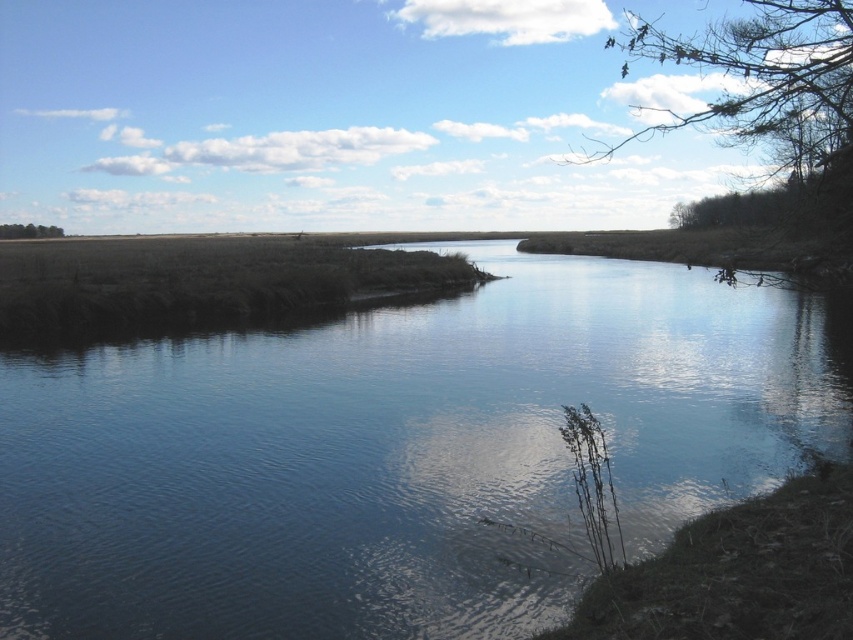
Question: Is clear water at center to the left of green leafy tree at left from the viewer's perspective?

Choices:
 (A) no
 (B) yes

Answer: (A)

Question: Among these points, which one is farthest from the camera?

Choices:
 (A) (16, 228)
 (B) (795, 244)
 (C) (448, 410)

Answer: (A)

Question: Which object is closer to the camera taking this photo?

Choices:
 (A) green leafy tree at left
 (B) bare branches at upper right

Answer: (B)

Question: Which point appears closest to the camera in this image?

Choices:
 (A) (51, 234)
 (B) (10, 378)
 (C) (827, 132)

Answer: (C)

Question: Is clear water at center closer to the viewer compared to green leafy tree at left?

Choices:
 (A) no
 (B) yes

Answer: (B)

Question: Does bare branches at upper right come in front of green leafy tree at left?

Choices:
 (A) no
 (B) yes

Answer: (B)